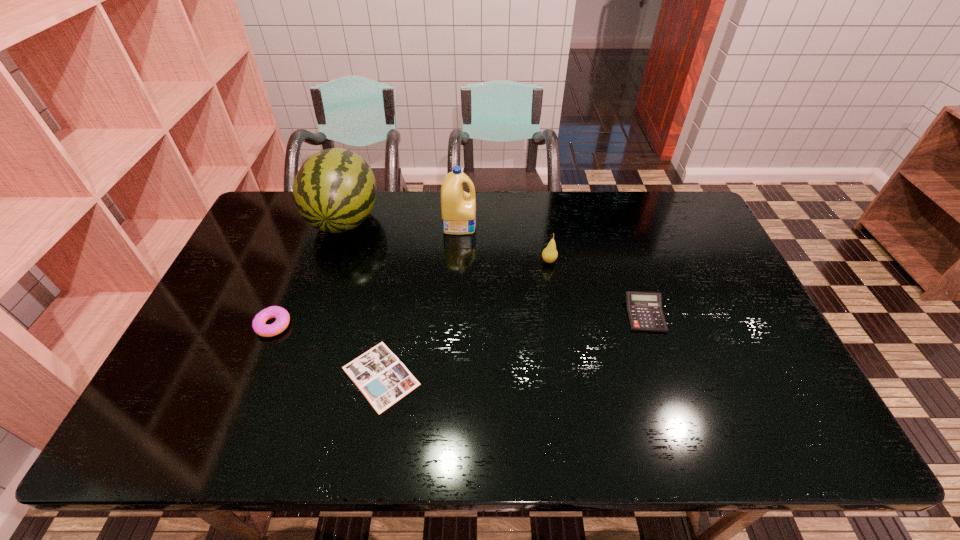
What are the coordinates of `watermelon` in the screenshot? It's located at (334, 191).

Locate an element on the screen. the fourth object from left to right is located at coordinates (458, 208).

Locate an element on the screen. the third tallest object is located at coordinates click(x=549, y=254).

The height and width of the screenshot is (540, 960). I want to click on the fourth nearest object, so point(549,254).

You are a GUI agent. You are given a task and a screenshot of the screen. Output one action in this format:
    pyautogui.click(x=<x>, y=<y>)
    Task: Click on the doughnut
    The image size is (960, 540).
    Given the screenshot: What is the action you would take?
    pyautogui.click(x=282, y=316)

In order to click on the rightmost object in this screenshot , I will do (x=644, y=309).

Locate an element on the screen. The width and height of the screenshot is (960, 540). the shortest object is located at coordinates point(383,379).

Find the location of a particular element. the nearest object is located at coordinates (383, 379).

Find the location of a particular element. The height and width of the screenshot is (540, 960). vacant area situated 0.310m at the stem end of the watermelon is located at coordinates [x=308, y=328].

Find the location of `free spot located 0.080m on the label of the detergent`. free spot located 0.080m on the label of the detergent is located at coordinates (499, 224).